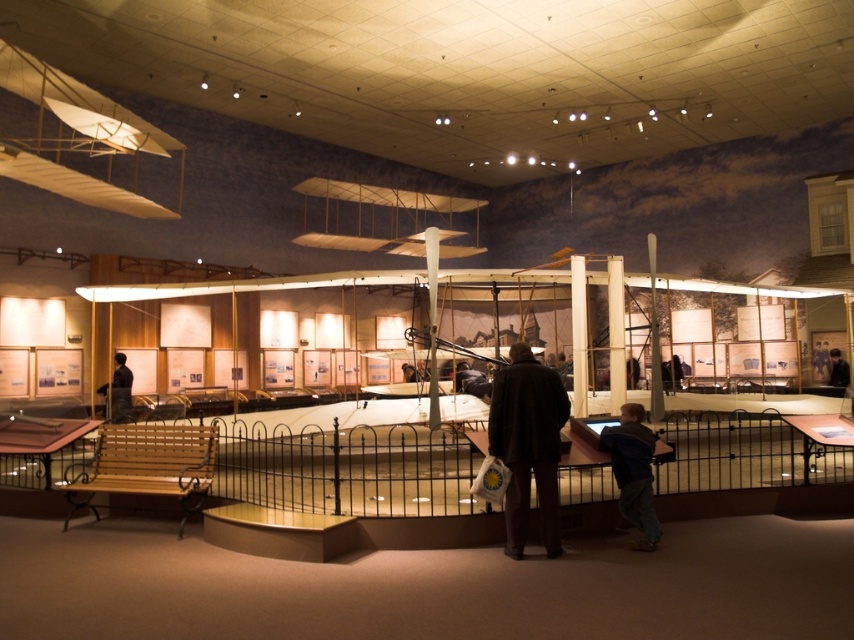
Question: Is dark brown coat at center to the right of blue denim jacket at lower right from the viewer's perspective?

Choices:
 (A) no
 (B) yes

Answer: (A)

Question: Among these objects, which one is nearest to the camera?

Choices:
 (A) dark brown leather jacket at lower left
 (B) black leather jacket at center

Answer: (A)

Question: Which point is farther to the camera?

Choices:
 (A) (839, 368)
 (B) (819, 445)

Answer: (A)

Question: Which point is closer to the camera?

Choices:
 (A) dark brown coat at center
 (B) black leather jacket at center

Answer: (A)

Question: Does black metal fence at lower center have a smaller size compared to dark brown leather jacket at lower left?

Choices:
 (A) yes
 (B) no

Answer: (A)

Question: In this image, where is blue denim jacket at lower right located relative to dark brown leather jacket at lower left?

Choices:
 (A) right
 (B) left

Answer: (A)